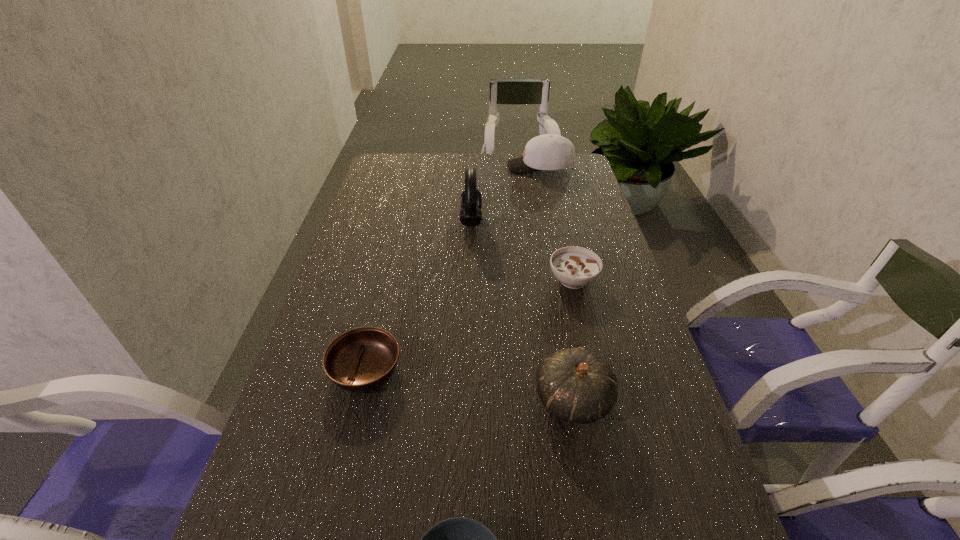
Identify the location of the second farthest object. (471, 200).

The width and height of the screenshot is (960, 540). In order to click on headset in this screenshot , I will do `click(471, 200)`.

Locate an element on the screen. This screenshot has width=960, height=540. the farthest object is located at coordinates [548, 151].

This screenshot has height=540, width=960. Find the location of `gourd`. gourd is located at coordinates (575, 385).

Image resolution: width=960 pixels, height=540 pixels. Identify the location of the farthest soup bowl. (575, 267).

Find the location of a particular element. The image size is (960, 540). the rightmost soup bowl is located at coordinates (575, 267).

I want to click on the second nearest soup bowl, so click(362, 359).

Where is `the leftmost object`? Image resolution: width=960 pixels, height=540 pixels. the leftmost object is located at coordinates (362, 359).

The image size is (960, 540). Find the location of `vacant space located on the earcups of the tallest object`. vacant space located on the earcups of the tallest object is located at coordinates (570, 220).

Where is `free spot located on the front-facing side of the baseball cap`? This screenshot has width=960, height=540. free spot located on the front-facing side of the baseball cap is located at coordinates (420, 167).